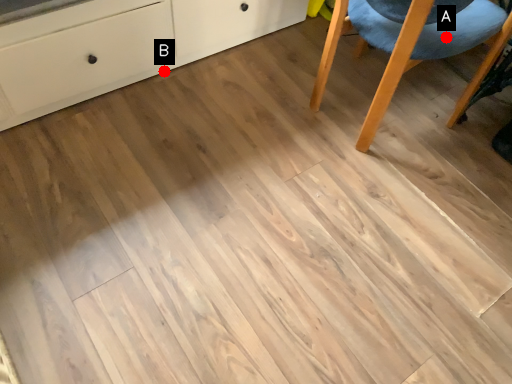
Question: Two points are circled on the image, labeled by A and B beside each circle. Which point appears closest to the camera in this image?

Choices:
 (A) A is closer
 (B) B is closer

Answer: (A)